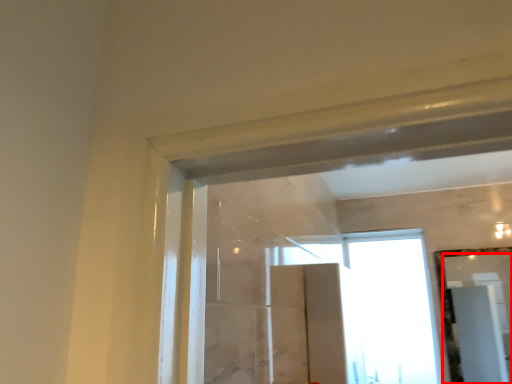
Question: From the image's perspective, considering the relative positions of mirror (annotated by the red box) and window in the image provided, where is mirror (annotated by the red box) located with respect to the staircase?

Choices:
 (A) below
 (B) above

Answer: (B)